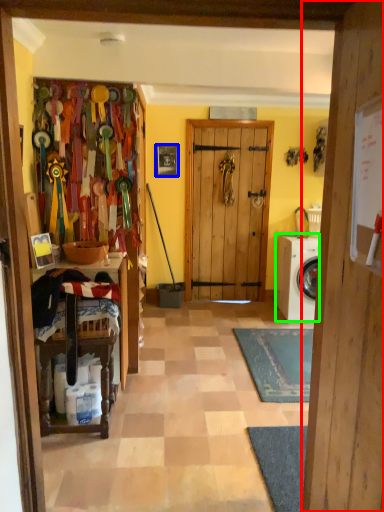
Question: Based on their relative distances, which object is farther from door (highlighted by a red box)? Choose from picture frame (highlighted by a blue box) and washing machine (highlighted by a green box).

Choices:
 (A) picture frame
 (B) washing machine

Answer: (A)